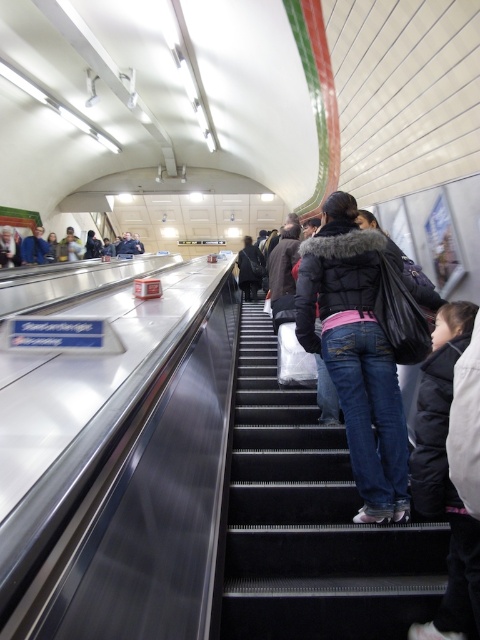
Question: Which object is the farthest from the black rubber stairs at center?

Choices:
 (A) dark blue jacket at center
 (B) dark gray jacket at upper left

Answer: (B)

Question: Which of these objects is positioned farthest from the black rubber stairs at center?

Choices:
 (A) dark blue jacket at center
 (B) dark gray jacket at upper left

Answer: (B)

Question: Which object is closer to the camera taking this photo?

Choices:
 (A) dark blue jacket at center
 (B) black rubber stairs at center
 (C) dark gray jacket at upper left

Answer: (B)

Question: Can you confirm if black rubber stairs at center is bigger than dark blue jacket at center?

Choices:
 (A) yes
 (B) no

Answer: (B)

Question: Does black rubber stairs at center appear under dark blue jacket at center?

Choices:
 (A) yes
 (B) no

Answer: (A)

Question: Observing the image, what is the correct spatial positioning of black rubber stairs at center in reference to dark blue jacket at center?

Choices:
 (A) right
 (B) left

Answer: (A)